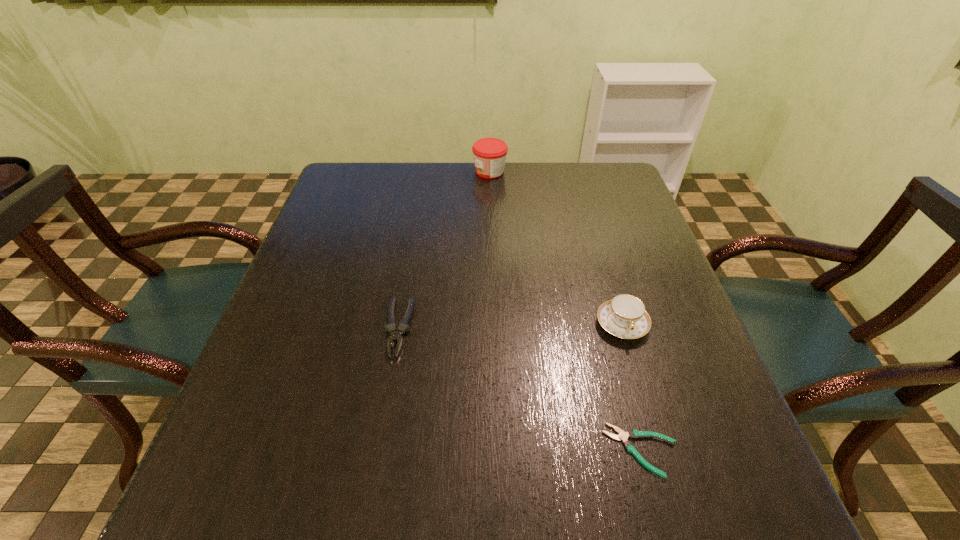
Image resolution: width=960 pixels, height=540 pixels. Identify the location of vacant space located 0.310m on the side with the handle of the third shortest object. (679, 512).

Identify the location of vacant region located 0.230m at the gripping part of the left pliers. This screenshot has height=540, width=960. (372, 482).

This screenshot has width=960, height=540. In order to click on vacant space located 0.160m on the left of the shortest object in this screenshot , I will do `click(509, 450)`.

This screenshot has width=960, height=540. Identify the location of object positioned at the far edge. (489, 154).

You are a GUI agent. You are given a task and a screenshot of the screen. Output one action in this format:
    pyautogui.click(x=<x>, y=<y>)
    Task: Click on the object positioned at the near edge
    This screenshot has height=540, width=960.
    Given the screenshot: What is the action you would take?
    pyautogui.click(x=633, y=433)

This screenshot has width=960, height=540. I want to click on teacup that is at the right edge, so click(624, 316).

Where is `pliers at the right edge`? This screenshot has height=540, width=960. pliers at the right edge is located at coordinates (633, 433).

Where is `object present at the near right corner`? object present at the near right corner is located at coordinates (633, 433).

Identify the location of vacant space at the far edge of the desktop. (517, 185).

Find the location of a particular element. The height and width of the screenshot is (540, 960). vacant space at the near edge of the desktop is located at coordinates (318, 487).